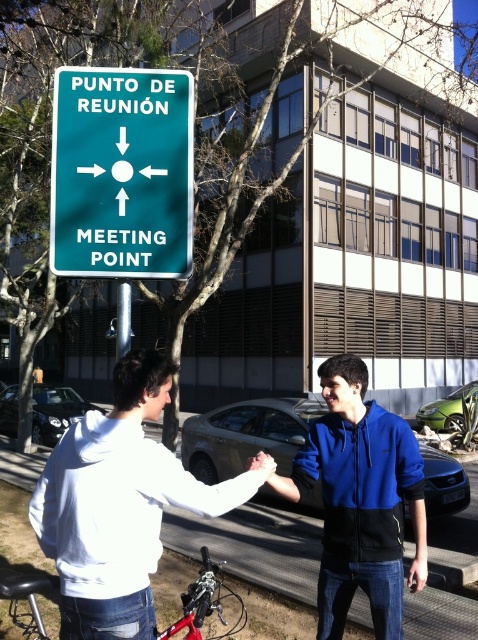
Does point (154, 182) come closer to viewer compared to point (262, 413)?

Yes, it is in front of point (262, 413).

Between green metallic sign at upper center and metallic gray sedan at center, which one has more height?

green metallic sign at upper center is taller.

Is point (66, 100) positioned behind point (286, 408)?

No, (66, 100) is closer to viewer.

The height and width of the screenshot is (640, 478). What are the coordinates of `green metallic sign at upper center` in the screenshot? It's located at (121, 172).

In the scene shown: Which of these two, green metallic sign at upper center or metallic pole at center, stands shorter?

green metallic sign at upper center is shorter.

Measure the distance from green metallic sign at upper center to metallic pole at center.

green metallic sign at upper center is 29.20 inches from metallic pole at center.

Where is `green metallic sign at upper center`? The image size is (478, 640). green metallic sign at upper center is located at coordinates (121, 172).

Does white hoodie at center lie behind shiny black car at lower left?

That is False.

Who is lower down, white hoodie at center or shiny black car at lower left?

shiny black car at lower left is below.

What are the coordinates of `white hoodie at center` in the screenshot? It's located at (119, 506).

Identify the location of white hoodie at center. This screenshot has width=478, height=640. (119, 506).